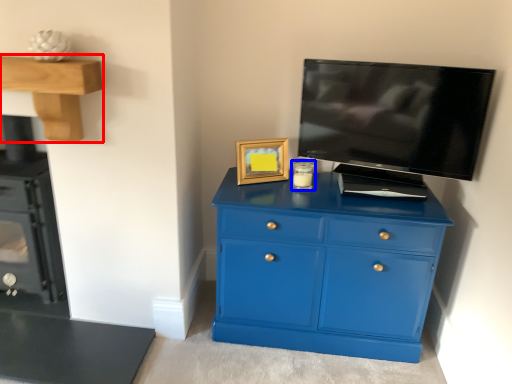
Question: Which object appears closest to the camera in this image, vanity (highlighted by a red box) or candle holder (highlighted by a blue box)?

Choices:
 (A) vanity
 (B) candle holder

Answer: (A)